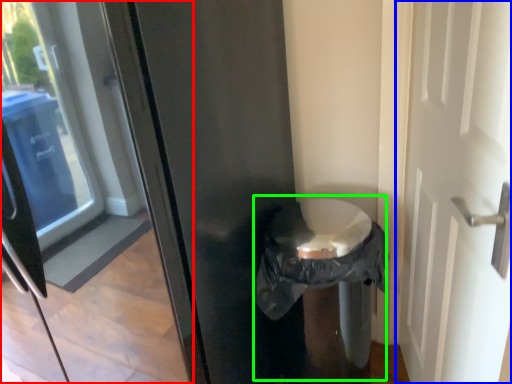
Question: Which is nearer to the glass door (highlighted by a red box)? door (highlighted by a blue box) or garbage (highlighted by a green box).

Choices:
 (A) door
 (B) garbage

Answer: (B)